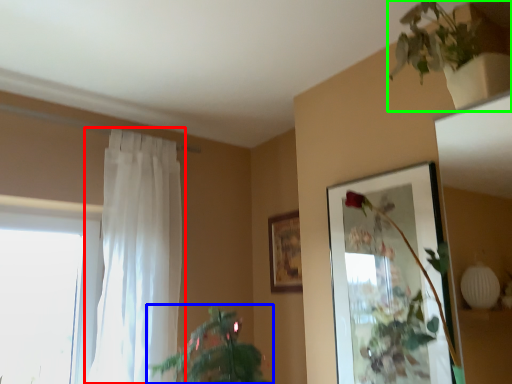
Question: Based on their relative distances, which object is nearer to curtain (highlighted by a red box)? Choose from houseplant (highlighted by a blue box) and houseplant (highlighted by a green box).

Choices:
 (A) houseplant
 (B) houseplant

Answer: (A)